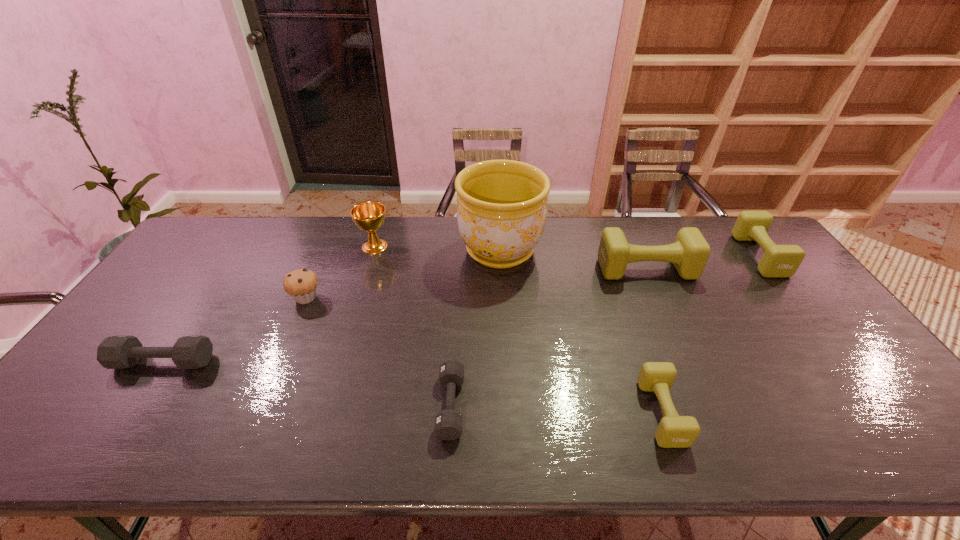
Locate an element on the screen. The height and width of the screenshot is (540, 960). the nearest olive dumbbell is located at coordinates (674, 431).

Identify the location of the shortest dumbbell. This screenshot has height=540, width=960. (448, 423).

In order to click on the fourth dumbbell from right to left in this screenshot , I will do `click(448, 423)`.

Locate an element on the screen. free space located on the left of the tallest object is located at coordinates (437, 250).

I want to click on free space located 0.120m on the front of the chalice, so 365,280.

Find the location of a particular element. The image size is (960, 540). vacant space located on the front of the biggest olive dumbbell is located at coordinates (665, 312).

The image size is (960, 540). In order to click on free space located on the left of the second biggest olive dumbbell in this screenshot , I will do `click(651, 255)`.

Image resolution: width=960 pixels, height=540 pixels. Find the location of `vacant area located on the front of the muffin`. vacant area located on the front of the muffin is located at coordinates (256, 413).

Locate an element on the screen. This screenshot has height=540, width=960. vacant space located on the front of the left gray dumbbell is located at coordinates (127, 417).

Find the location of a particular element. This screenshot has height=540, width=960. free spot located on the right of the smallest olive dumbbell is located at coordinates (850, 413).